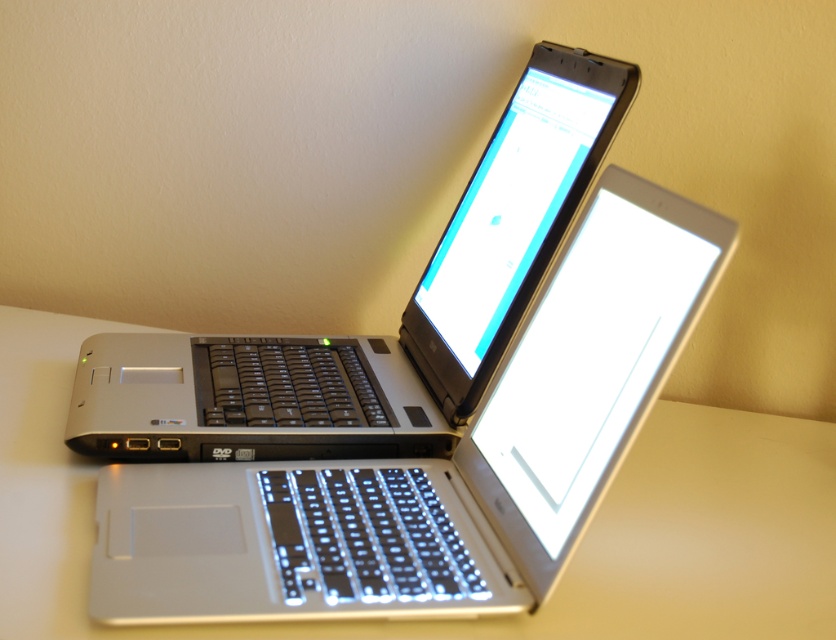
This screenshot has width=836, height=640. In order to click on white matte table at center in this screenshot , I will do `click(482, 618)`.

Does white matte table at center have a greater height compared to satin silver laptop at center?

No.

Is point (627, 611) positioned in front of point (520, 216)?

Yes, it is in front of point (520, 216).

Locate an element on the screen. white matte table at center is located at coordinates (482, 618).